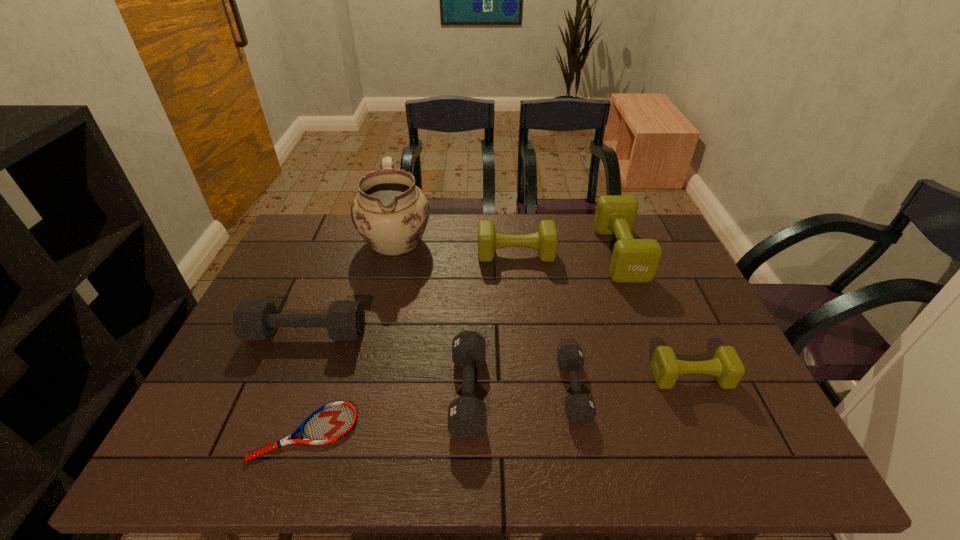
Locate an element on the screen. This screenshot has height=540, width=960. the rightmost gray dumbbell is located at coordinates (580, 409).

The image size is (960, 540). I want to click on tennis racket, so click(x=331, y=422).

Identify the location of blue tennis racket. (331, 422).

At what (x,y) coordinates should I click in order to perform the action: click on free space located on the spout of the tallest object. Please return your answer as a coordinate pair (x, y). The height and width of the screenshot is (540, 960). Looking at the image, I should click on (378, 315).

Locate an element on the screen. The width and height of the screenshot is (960, 540). free spot located 0.240m on the left of the biggest olive dumbbell is located at coordinates (525, 253).

At what (x,y) coordinates should I click in order to perform the action: click on free space located on the left of the leftmost olive dumbbell. Please return your answer as a coordinate pair (x, y). Image resolution: width=960 pixels, height=540 pixels. Looking at the image, I should click on (394, 254).

Where is `free space located on the back of the fourth nearest dumbbell`? The height and width of the screenshot is (540, 960). free space located on the back of the fourth nearest dumbbell is located at coordinates (342, 242).

The height and width of the screenshot is (540, 960). Find the location of `blank space located 0.390m on the left of the second gray dumbbell from left to right`. blank space located 0.390m on the left of the second gray dumbbell from left to right is located at coordinates (282, 392).

Find the location of `vacant area situated on the left of the nearest olive dumbbell`. vacant area situated on the left of the nearest olive dumbbell is located at coordinates (564, 377).

You are a GUI agent. You are given a task and a screenshot of the screen. Output one action in this format:
    pyautogui.click(x=<x>, y=<y>)
    Task: Click on the vacant position located on the back of the shortest dumbbell
    Image resolution: width=960 pixels, height=540 pixels.
    Given the screenshot: What is the action you would take?
    pyautogui.click(x=563, y=333)